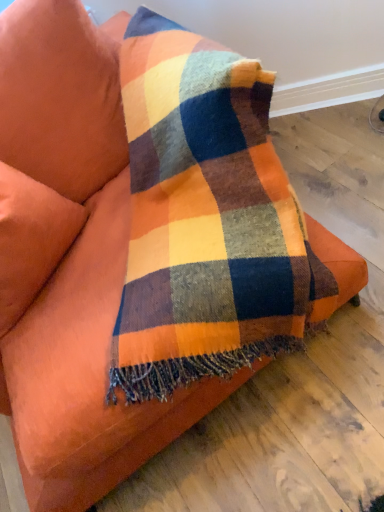
What do you see at coordinates (31, 239) in the screenshot? I see `orange fabric pillow at left` at bounding box center [31, 239].

You are a GUI agent. You are given a task and a screenshot of the screen. Output one action in this format:
    pyautogui.click(x=<x>, y=<y>)
    Task: Click on the orange fabric pillow at left
    
    Given the screenshot: What is the action you would take?
    pyautogui.click(x=31, y=239)

You are a GUI agent. You are given a task and a screenshot of the screen. Output one action in this format:
    pyautogui.click(x=<x>, y=<y>)
    Task: Click on the orange fabric pillow at left
    The height and width of the screenshot is (512, 384).
    Given the screenshot: What is the action you would take?
    pyautogui.click(x=31, y=239)